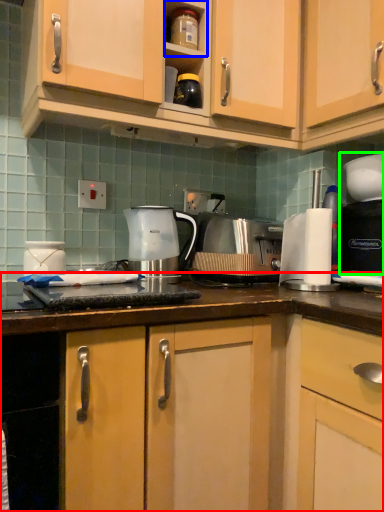
Question: Which object is positioned farthest from countertop (highlighted by a red box)? Select from shelf (highlighted by a blue box) and coffee machine (highlighted by a green box).

Choices:
 (A) shelf
 (B) coffee machine

Answer: (A)